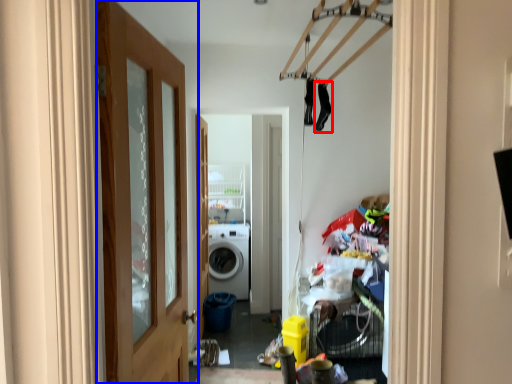
Question: Which of the following is the closest to the observer, clothing (highlighted by a red box) or door (highlighted by a blue box)?

Choices:
 (A) clothing
 (B) door

Answer: (B)